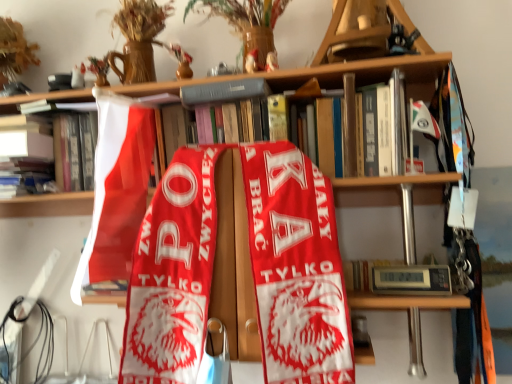
Question: Does point (44, 162) appear closer or farther from the camera than point (252, 86)?

Choices:
 (A) closer
 (B) farther

Answer: (B)

Question: Looking at their shapes, would you say matte white book at upper left, which appears as the 1th book when viewed from the left, is wider or thinner than hardcover book at upper center, acting as the third book starting from the left?

Choices:
 (A) wide
 (B) thin

Answer: (A)

Question: Based on their relative distances, which object is nearer to the red fabric scarf at center?

Choices:
 (A) hardcover book at upper center, acting as the 2th book starting from the right
 (B) hardcover book at upper center, acting as the third book starting from the left
 (C) matte white book at upper left, which appears as the 1th book when viewed from the left

Answer: (A)

Question: Which is farther from the hardcover book at upper center, acting as the 2th book starting from the right?

Choices:
 (A) hardcover book at upper center, acting as the third book starting from the left
 (B) red fabric scarf at center
 (C) matte white book at upper left, which appears as the 1th book when viewed from the left

Answer: (B)